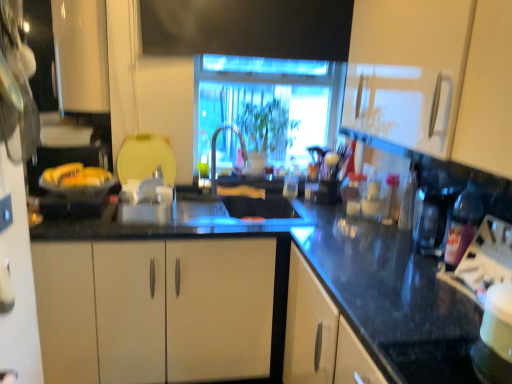
Question: From a real-world perspective, is transparent glass window at center physically above translucent plastic bottle at center, placed as the first bottle when sorted from top to bottom?

Choices:
 (A) yes
 (B) no

Answer: (A)

Question: Could translucent plastic bottle at center, which ranks as the 1th bottle in left-to-right order, be considered to be inside transparent glass window at center?

Choices:
 (A) yes
 (B) no

Answer: (B)

Question: From the image's perspective, is transparent glass window at center located beneath translucent plastic bottle at center, which appears as the second bottle when viewed from the right?

Choices:
 (A) yes
 (B) no

Answer: (B)

Question: Is transparent glass window at center thinner than translucent plastic bottle at center, which appears as the second bottle when viewed from the right?

Choices:
 (A) yes
 (B) no

Answer: (B)

Question: Is transparent glass window at center aimed at translucent plastic bottle at center, which is counted as the second bottle, starting from the front?

Choices:
 (A) no
 (B) yes

Answer: (B)

Question: Considering the positions of point (263, 66) and point (211, 147), is point (263, 66) closer or farther from the camera than point (211, 147)?

Choices:
 (A) farther
 (B) closer

Answer: (B)

Question: Relative to satin nickel faucet at center, is transparent glass window at center in front or behind?

Choices:
 (A) front
 (B) behind

Answer: (B)

Question: Is transparent glass window at center taller or shorter than satin nickel faucet at center?

Choices:
 (A) tall
 (B) short

Answer: (A)

Question: From a real-world perspective, is transparent glass window at center above or below satin nickel faucet at center?

Choices:
 (A) below
 (B) above

Answer: (B)

Question: Is satin nickel faucet at center in front of or behind transparent glass window at center in the image?

Choices:
 (A) front
 (B) behind

Answer: (A)

Question: From a real-world perspective, is satin nickel faucet at center above or below transparent glass window at center?

Choices:
 (A) below
 (B) above

Answer: (A)

Question: Considering the positions of point [x=244, y=145] and point [x=200, y=153], is point [x=244, y=145] closer or farther from the camera than point [x=200, y=153]?

Choices:
 (A) closer
 (B) farther

Answer: (A)

Question: Is satin nickel faucet at center wider or thinner than transparent glass window at center?

Choices:
 (A) wide
 (B) thin

Answer: (B)

Question: Considering the positions of white glossy cabinet at upper left, marked as the 2th cabinetry in a right-to-left arrangement, and transparent glass window at center in the image, is white glossy cabinet at upper left, marked as the 2th cabinetry in a right-to-left arrangement, wider or thinner than transparent glass window at center?

Choices:
 (A) wide
 (B) thin

Answer: (B)

Question: Is white glossy cabinet at upper left, acting as the 1th cabinetry starting from the back, bigger or smaller than transparent glass window at center?

Choices:
 (A) small
 (B) big

Answer: (A)